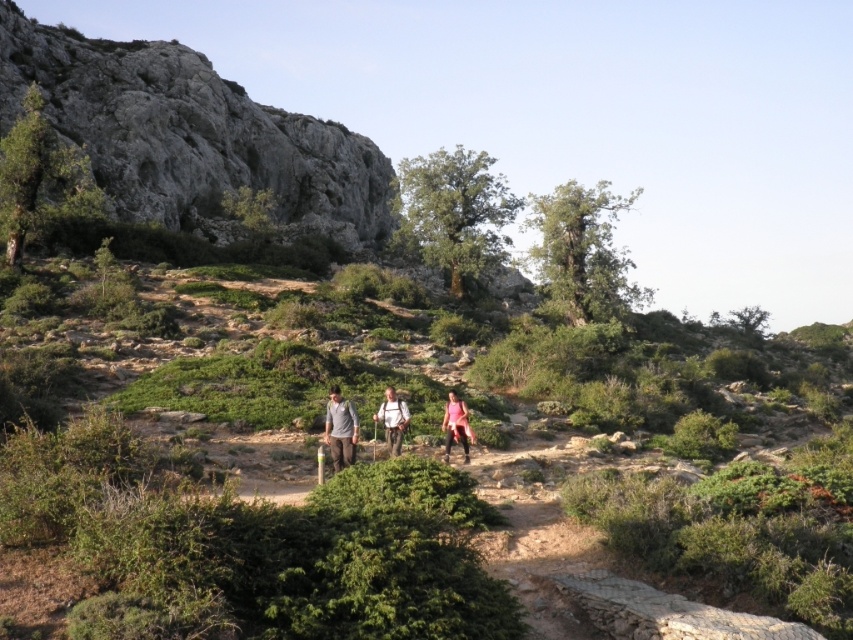
Question: Does light brown leather backpack at center come behind pink fabric at center?

Choices:
 (A) yes
 (B) no

Answer: (B)

Question: Does rugged stone hillside at upper left appear under green leafy tree at center?

Choices:
 (A) yes
 (B) no

Answer: (A)

Question: Which object is positioned farthest from the matte gray pants at center?

Choices:
 (A) light brown leather backpack at center
 (B) pink fabric at center
 (C) green leafy tree at center

Answer: (C)

Question: Among these points, which one is nearest to the camera?

Choices:
 (A) (442, 428)
 (B) (454, 438)
 (C) (54, 141)

Answer: (B)

Question: Is matte gray pants at center positioned in front of light brown leather backpack at center?

Choices:
 (A) no
 (B) yes

Answer: (A)

Question: Which point is closer to the camera?

Choices:
 (A) light brown leather backpack at center
 (B) gray fabric jacket at center
 (C) green leafy tree at upper right
 (D) matte gray pants at center

Answer: (B)